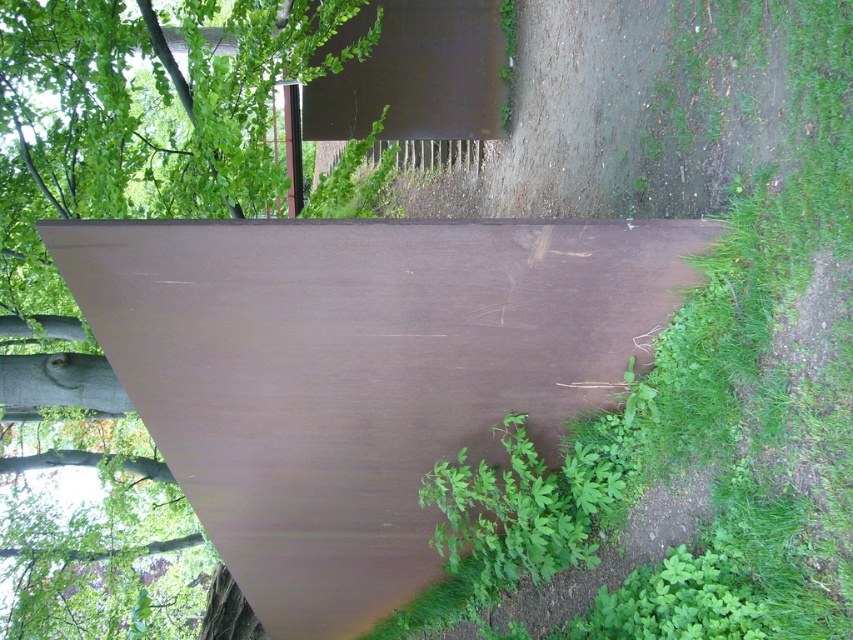
Question: Which point is closer to the camera?

Choices:
 (A) brown matte board at center
 (B) green matte tree at upper left

Answer: (A)

Question: Among these objects, which one is nearest to the camera?

Choices:
 (A) brown matte board at center
 (B) green matte tree at upper left

Answer: (A)

Question: Is brown matte board at center bigger than green matte tree at upper left?

Choices:
 (A) yes
 (B) no

Answer: (B)

Question: Can you confirm if brown matte board at center is positioned above green matte tree at upper left?

Choices:
 (A) yes
 (B) no

Answer: (B)

Question: Where is brown matte board at center located in relation to green matte tree at upper left in the image?

Choices:
 (A) below
 (B) above

Answer: (A)